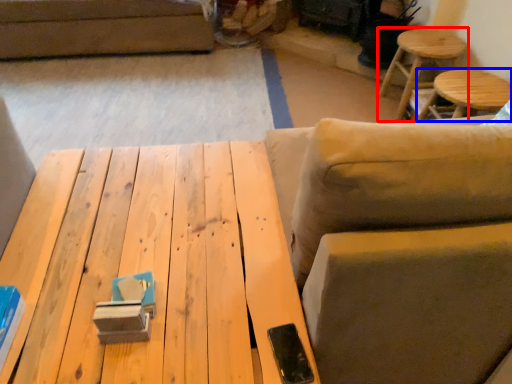
Question: Which point is closer to the camera, stool (highlighted by a red box) or stool (highlighted by a blue box)?

Choices:
 (A) stool
 (B) stool

Answer: (B)